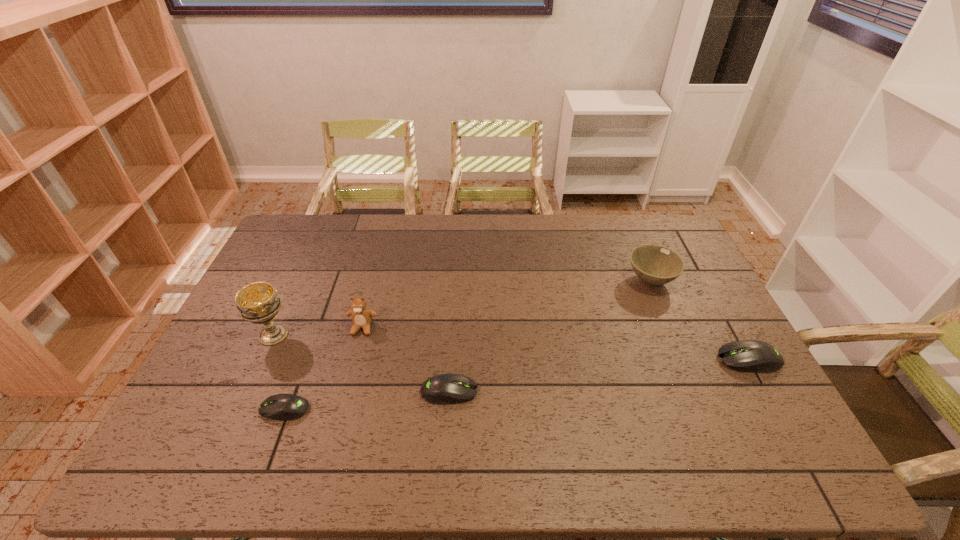
The image size is (960, 540). What are the coordinates of `bowl at the right edge` in the screenshot? It's located at (655, 265).

This screenshot has width=960, height=540. I want to click on vacant space at the far edge, so click(592, 214).

The height and width of the screenshot is (540, 960). In the image, there is a desktop. In order to click on free space at the near edge in this screenshot , I will do `click(421, 424)`.

I want to click on free space at the left edge, so click(x=217, y=367).

The height and width of the screenshot is (540, 960). In order to click on blank space at the far left corner in this screenshot , I will do `click(294, 239)`.

At what (x,y) coordinates should I click in order to perform the action: click on vacant space at the far right corner of the desktop. Please return your answer as a coordinate pair (x, y). The image size is (960, 540). Looking at the image, I should click on (672, 246).

This screenshot has height=540, width=960. I want to click on vacant space that is in between the tallest object and the shortest computer mouse, so click(279, 372).

Identify the location of vacant space in between the farthest computer mouse and the shortest computer mouse. The image size is (960, 540). (516, 384).

Locate an element on the screen. The height and width of the screenshot is (540, 960). vacant region between the tallest object and the bowl is located at coordinates (462, 308).

Where is `unoccupied position between the tallest object and the third object from left to right`? Image resolution: width=960 pixels, height=540 pixels. unoccupied position between the tallest object and the third object from left to right is located at coordinates (318, 331).